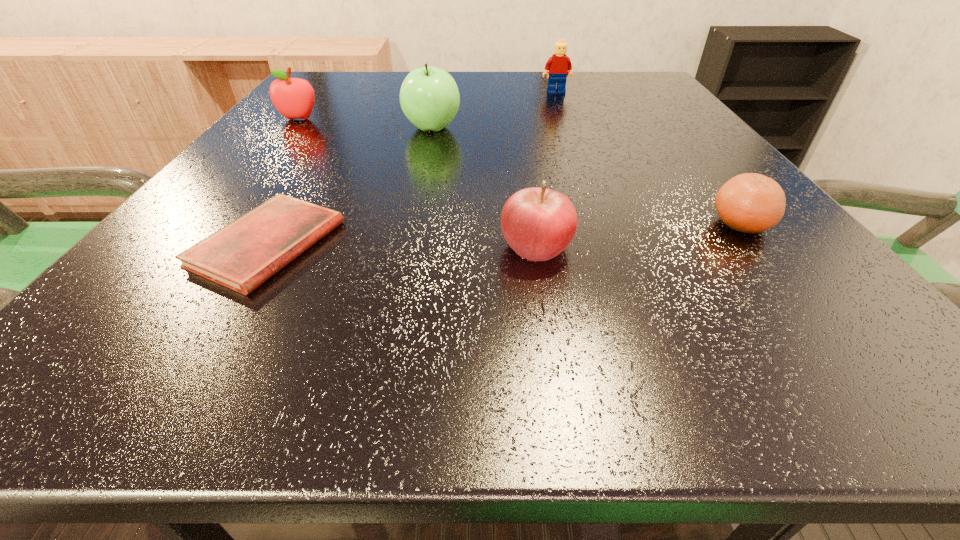
Image resolution: width=960 pixels, height=540 pixels. I want to click on vacant space at the left edge, so click(x=254, y=161).

I want to click on vacant area at the right edge, so click(722, 272).

You are a GUI agent. You are given a task and a screenshot of the screen. Output one action in this format:
    pyautogui.click(x=<x>, y=<y>)
    Task: Click on the vacant region at the near left corner of the desktop
    
    Given the screenshot: What is the action you would take?
    pyautogui.click(x=150, y=329)

Locate an element on the screen. The height and width of the screenshot is (540, 960). free space that is in between the rightmost object and the rightmost apple is located at coordinates (638, 235).

Locate an element on the screen. free space between the diary and the fourth object from right to left is located at coordinates (350, 186).

The height and width of the screenshot is (540, 960). In order to click on free space between the second apple from left to right and the clementine in this screenshot , I will do `click(587, 176)`.

Where is `free space that is in between the fifth object from left to right and the diary`? The width and height of the screenshot is (960, 540). free space that is in between the fifth object from left to right and the diary is located at coordinates (412, 168).

This screenshot has width=960, height=540. Find the location of `free space between the farthest object and the shortest object`. free space between the farthest object and the shortest object is located at coordinates (412, 168).

This screenshot has height=540, width=960. Find the location of `blank region between the shortest object and the nearest apple`. blank region between the shortest object and the nearest apple is located at coordinates (402, 245).

You are a GUI agent. You are given a task and a screenshot of the screen. Output one action in this format:
    pyautogui.click(x=<x>, y=<y>)
    Task: Click on the free space between the shortest object and the Lego
    
    Given the screenshot: What is the action you would take?
    pyautogui.click(x=412, y=168)